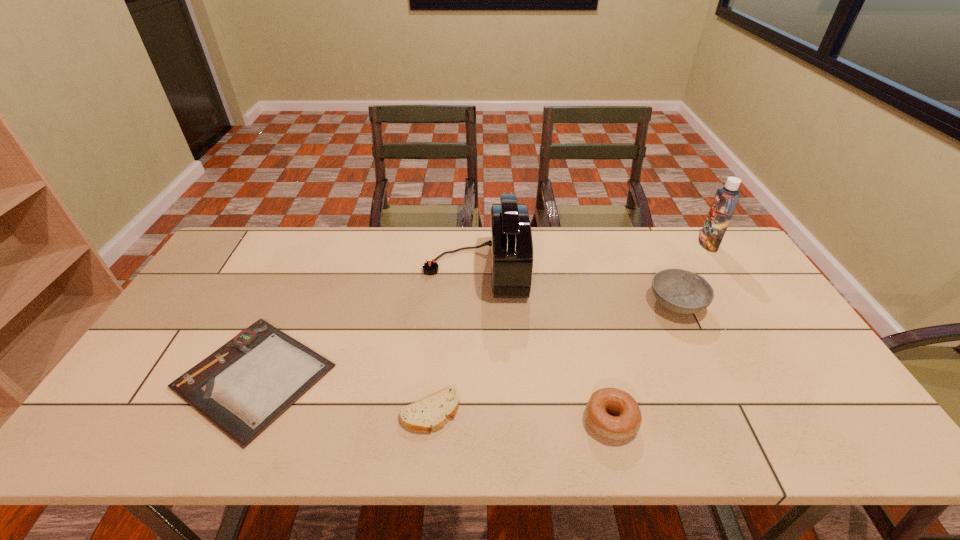
This screenshot has width=960, height=540. Identify the location of vacant space at the far left corner. (256, 268).

Locate an element on the screen. The height and width of the screenshot is (540, 960). free space that is in between the radio receiver and the pita bread is located at coordinates (453, 340).

Find the location of a particular element. empty space that is in between the radio receiver and the bowl is located at coordinates (576, 286).

I want to click on free space between the pita bread and the radio receiver, so click(453, 340).

At what (x,y) coordinates should I click in order to perform the action: click on free space between the leftmost object and the radio receiver. Please return your answer as a coordinate pair (x, y). Looking at the image, I should click on (365, 322).

Where is `vacant region between the second object from right to left and the pita bread`? vacant region between the second object from right to left and the pita bread is located at coordinates (553, 357).

Where is `vacant space that is in between the shampoo and the fourth tallest object`? Image resolution: width=960 pixels, height=540 pixels. vacant space that is in between the shampoo and the fourth tallest object is located at coordinates (660, 332).

Find the location of a particular element. Image resolution: width=960 pixels, height=540 pixels. empty location between the fourth shortest object and the third shortest object is located at coordinates 643,362.

At what (x,y) coordinates should I click in order to perform the action: click on free space between the third object from right to left and the radio receiver. Please return your answer as a coordinate pair (x, y). Looking at the image, I should click on (543, 345).

Find the location of a particular element. vacant space that's between the shampoo and the second shortest object is located at coordinates (569, 328).